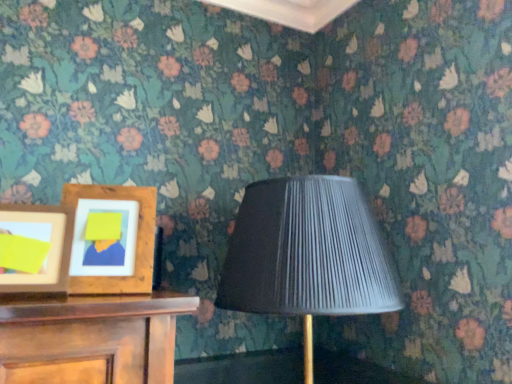
Question: Is wooden picture frame at left, the first picture frame in the right-to-left sequence, to the right of matte black lampshade at center from the viewer's perspective?

Choices:
 (A) yes
 (B) no

Answer: (B)

Question: Does wooden picture frame at left, placed as the 2th picture frame when sorted from left to right, have a lesser width compared to matte black lampshade at center?

Choices:
 (A) yes
 (B) no

Answer: (A)

Question: Could you tell me if wooden picture frame at left, placed as the 2th picture frame when sorted from left to right, is turned towards matte black lampshade at center?

Choices:
 (A) no
 (B) yes

Answer: (A)

Question: Is wooden picture frame at left, the first picture frame in the right-to-left sequence, touching matte black lampshade at center?

Choices:
 (A) no
 (B) yes

Answer: (A)

Question: From a real-world perspective, is wooden picture frame at left, placed as the 2th picture frame when sorted from left to right, positioned over matte black lampshade at center based on gravity?

Choices:
 (A) yes
 (B) no

Answer: (A)

Question: Is wooden picture frame at left, placed as the 2th picture frame when sorted from left to right, far from matte black lampshade at center?

Choices:
 (A) yes
 (B) no

Answer: (B)

Question: Is wooden picture frame at left, placed as the 2th picture frame when sorted from left to right, positioned beyond the bounds of wooden picture frame at left, which ranks as the first picture frame in left-to-right order?

Choices:
 (A) no
 (B) yes

Answer: (B)

Question: Can you confirm if wooden picture frame at left, the first picture frame in the right-to-left sequence, is positioned to the left of wooden picture frame at left, which ranks as the first picture frame in left-to-right order?

Choices:
 (A) no
 (B) yes

Answer: (A)

Question: Is wooden picture frame at left, the first picture frame in the right-to-left sequence, turned away from wooden picture frame at left, the second picture frame viewed from the right?

Choices:
 (A) yes
 (B) no

Answer: (B)

Question: Is wooden picture frame at left, the first picture frame in the right-to-left sequence, wider than wooden picture frame at left, the second picture frame viewed from the right?

Choices:
 (A) no
 (B) yes

Answer: (B)

Question: Is wooden picture frame at left, the first picture frame in the right-to-left sequence, further to the viewer compared to wooden picture frame at left, which ranks as the first picture frame in left-to-right order?

Choices:
 (A) yes
 (B) no

Answer: (A)

Question: Does wooden picture frame at left, placed as the 2th picture frame when sorted from left to right, have a larger size compared to wooden picture frame at left, the second picture frame viewed from the right?

Choices:
 (A) yes
 (B) no

Answer: (A)

Question: Is matte black lampshade at center to the right of wooden picture frame at left, the first picture frame in the right-to-left sequence, from the viewer's perspective?

Choices:
 (A) no
 (B) yes

Answer: (B)